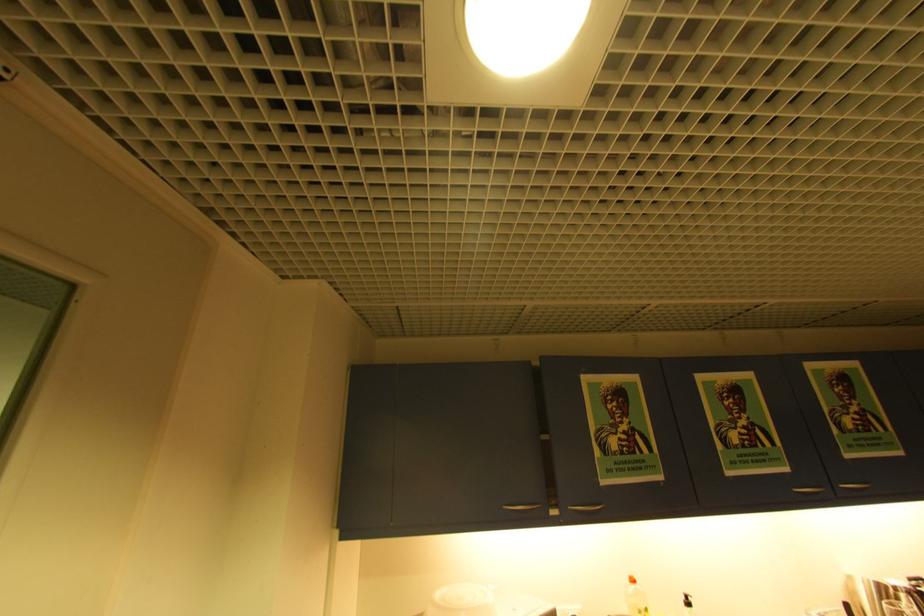
Find where to squeez the white spray bottle. Please return your answer as a coordinate pair (x, y).

(636, 598)